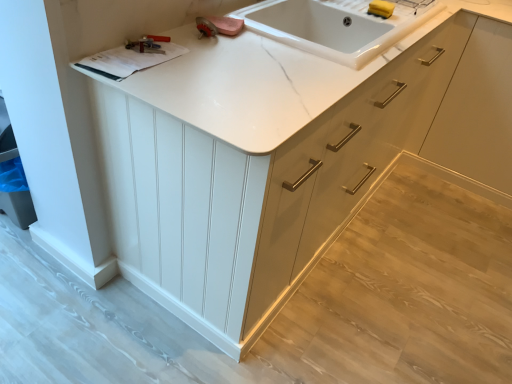
Locate an element on the screen. Image resolution: width=512 pixels, height=384 pixels. free space behind metallic silver tool at upper center is located at coordinates (178, 28).